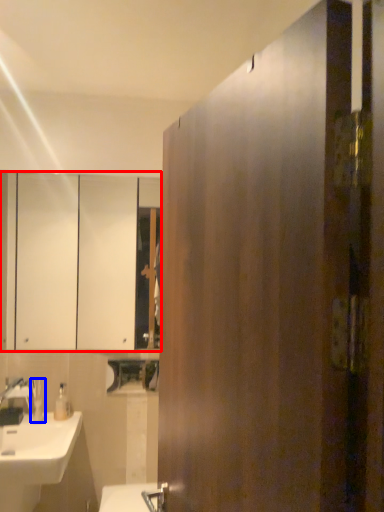
Question: Which object appears farthest to the camera in this image, cabinetry (highlighted by a red box) or toiletry (highlighted by a blue box)?

Choices:
 (A) cabinetry
 (B) toiletry

Answer: (A)